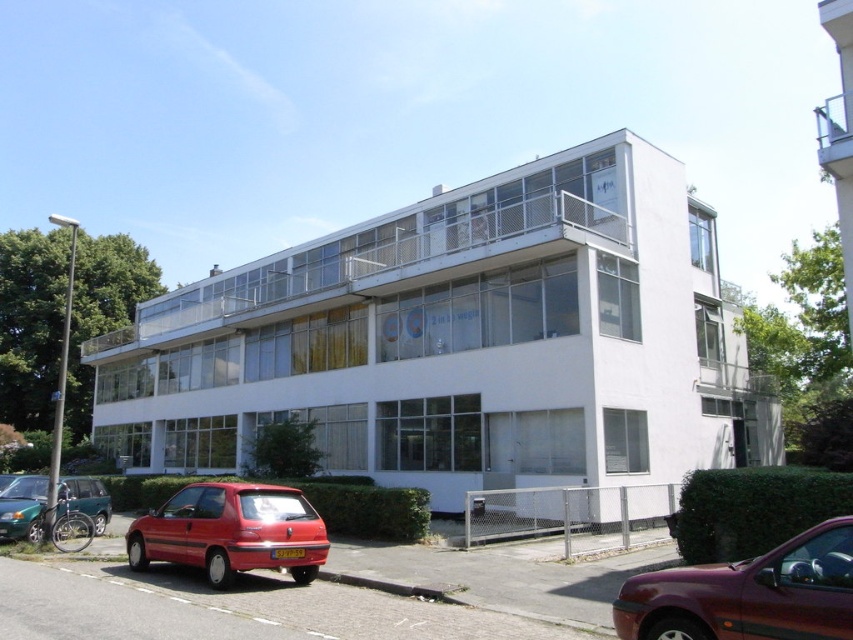
Question: Which of the following is the farthest from the observer?

Choices:
 (A) (339, 230)
 (B) (701, 612)

Answer: (A)

Question: From the image, what is the correct spatial relationship of clear glass balcony at center in relation to maroon metallic car at lower right?

Choices:
 (A) left
 (B) right

Answer: (A)

Question: Which object is positioned farthest from the matte red hatchback at lower left?

Choices:
 (A) maroon metallic car at lower right
 (B) green matte car at lower left

Answer: (A)

Question: Is maroon metallic car at lower right to the left of matte red hatchback at lower left from the viewer's perspective?

Choices:
 (A) no
 (B) yes

Answer: (A)

Question: Estimate the real-world distances between objects in this image. Which object is closer to the matte red hatchback at lower left?

Choices:
 (A) maroon metallic car at lower right
 (B) clear glass balcony at center

Answer: (A)

Question: Does clear glass balcony at center have a greater width compared to green matte car at lower left?

Choices:
 (A) no
 (B) yes

Answer: (B)